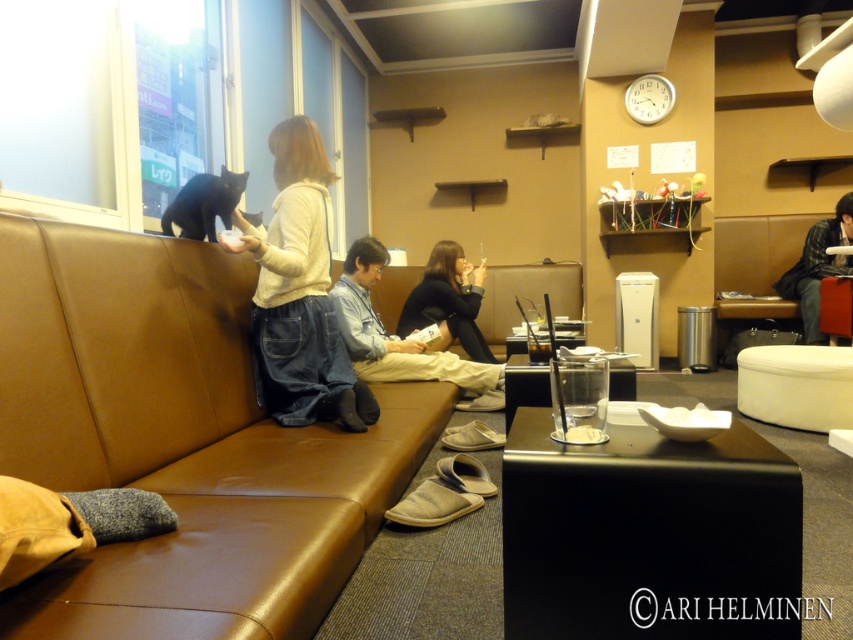
Question: Which point appears closest to the camera in this image?

Choices:
 (A) (801, 285)
 (B) (386, 260)
 (C) (456, 305)

Answer: (B)

Question: In this image, where is denim pants at center located relative to plaid flannel shirt at right?

Choices:
 (A) right
 (B) left

Answer: (B)

Question: Estimate the real-world distances between objects in this image. Which object is closer to the denim jeans at center?

Choices:
 (A) brown leather couch at center
 (B) black leather jacket at center
 (C) denim pants at center
 (D) plaid flannel shirt at right

Answer: (B)

Question: Is denim pants at center smaller than plaid flannel shirt at right?

Choices:
 (A) yes
 (B) no

Answer: (A)

Question: Does brown leather couch at center lie in front of denim jeans at center?

Choices:
 (A) no
 (B) yes

Answer: (B)

Question: Based on their relative distances, which object is nearer to the denim jeans at center?

Choices:
 (A) denim pants at center
 (B) black leather jacket at center

Answer: (B)